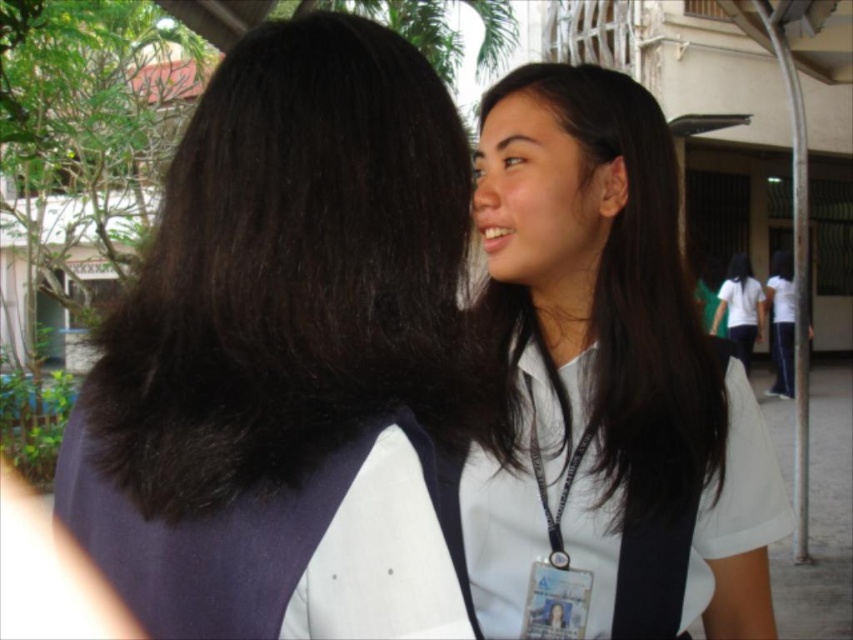
At what (x,y) coordinates should I click in order to perform the action: click on dark brown silky hair at upper right. Please return your answer as a coordinate pair (x, y). The height and width of the screenshot is (640, 853). Looking at the image, I should click on (288, 272).

Describe the element at coordinates (288, 272) in the screenshot. I see `dark brown silky hair at upper right` at that location.

In order to click on dark brown silky hair at upper right in this screenshot , I will do `click(288, 272)`.

You are a GUI agent. You are given a task and a screenshot of the screen. Output one action in this format:
    pyautogui.click(x=<x>, y=<y>)
    Task: Click on the dark brown silky hair at upper right
    Image resolution: width=853 pixels, height=640 pixels.
    Given the screenshot: What is the action you would take?
    pyautogui.click(x=288, y=272)

Is dark brown silky hair at upper right to the right of white matte uniform at center from the viewer's perspective?

In fact, dark brown silky hair at upper right is to the left of white matte uniform at center.

Which of these two, dark brown silky hair at upper right or white matte uniform at center, stands taller?

white matte uniform at center

Does point (132, 376) lie in front of point (717, 531)?

Yes, it is in front of point (717, 531).

The image size is (853, 640). In order to click on dark brown silky hair at upper right in this screenshot , I will do `click(288, 272)`.

Can you confirm if white matte uniform at center is positioned above white matte shirt at right?

Actually, white matte uniform at center is below white matte shirt at right.

Which is behind, point (561, 100) or point (750, 280)?

The point (750, 280) is more distant.

What do you see at coordinates (604, 365) in the screenshot? This screenshot has width=853, height=640. I see `white matte uniform at center` at bounding box center [604, 365].

This screenshot has height=640, width=853. I want to click on white matte uniform at center, so click(604, 365).